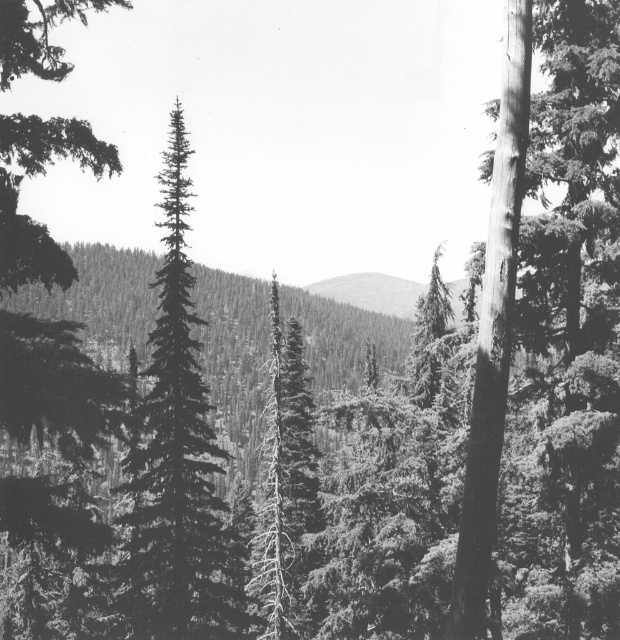
You are a hiker standing in the dense forest depicted in the image. You notice two points marked in the scene. Which point is nearer to you, point [42,8] or point [285,355]?

Point [42,8] is closer to the viewer than point [285,355].

You are a photographer standing at the camera position in the forest. You want to take a closeup shot of the smooth dark green tree at left. Given that your longest lens can focus as close as 40 feet, will you need to move closer to the tree to get a clear closeup?

The smooth dark green tree at left is 42.34 feet away from the camera. Since your lens can focus as close as 40 feet, you need to move 2.34 feet closer to the tree to achieve a clear closeup.